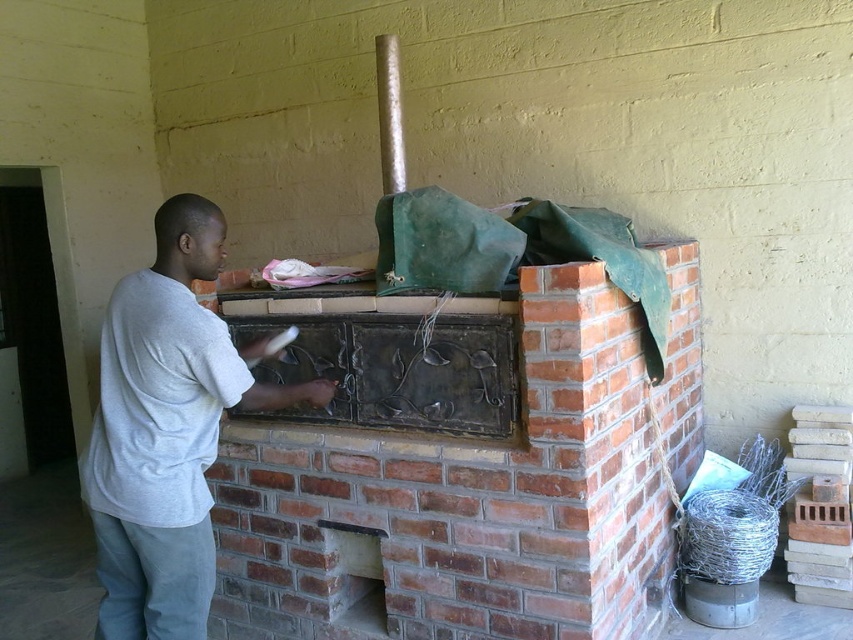
Question: Does brick fireplace at center have a smaller size compared to gray cotton shirt at center?

Choices:
 (A) yes
 (B) no

Answer: (B)

Question: Is brick fireplace at center wider than gray cotton shirt at center?

Choices:
 (A) no
 (B) yes

Answer: (B)

Question: Among these points, which one is farthest from the camera?

Choices:
 (A) (613, 403)
 (B) (177, 236)

Answer: (A)

Question: Is brick fireplace at center in front of gray cotton shirt at center?

Choices:
 (A) no
 (B) yes

Answer: (A)